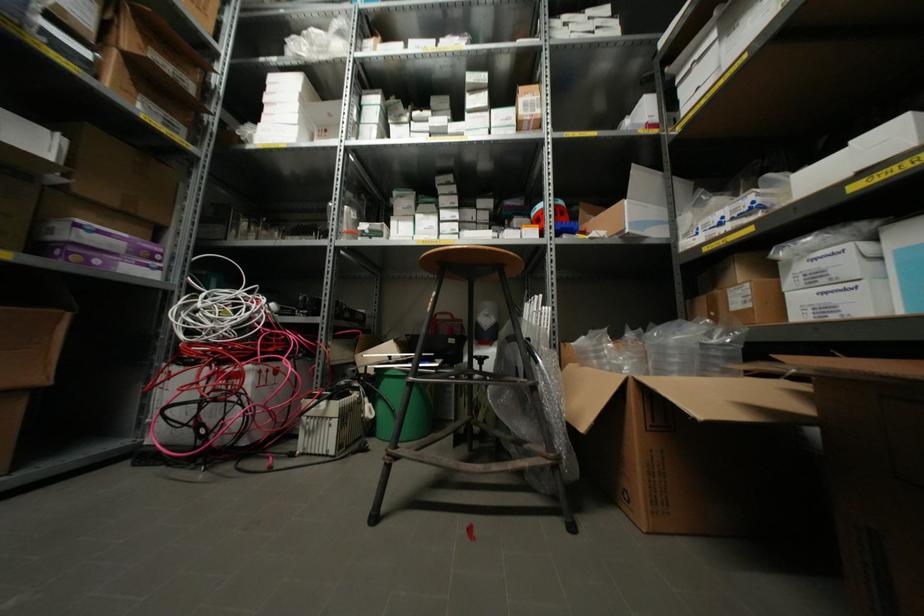
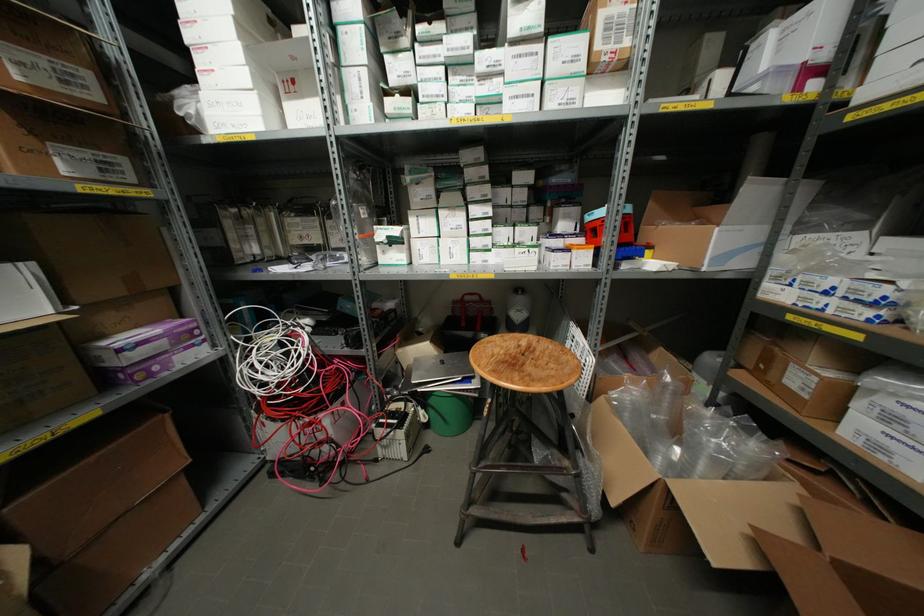
Locate, in the second image, the point that corresponds to (122,245) in the first image.

(163, 342)